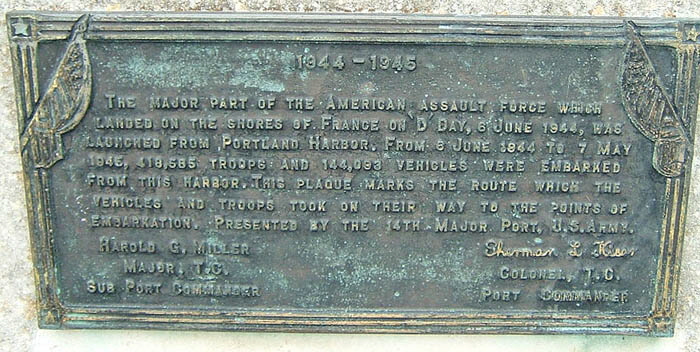
Locate an element on the screen. The image size is (700, 352). left side of frame around plaque is located at coordinates (31, 189).